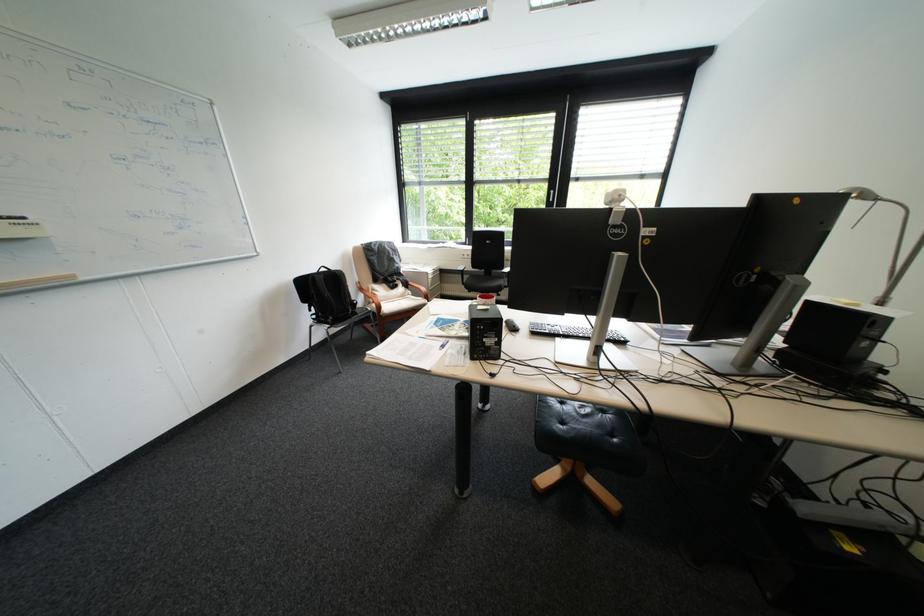
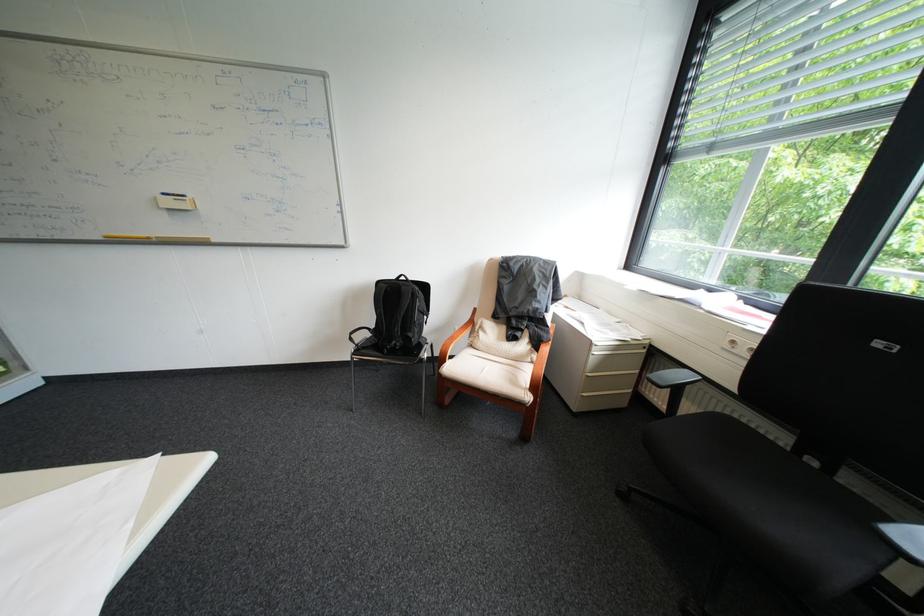
The point at [442,278] is marked in the first image. Where is the corresponding point in the second image?

(609, 353)